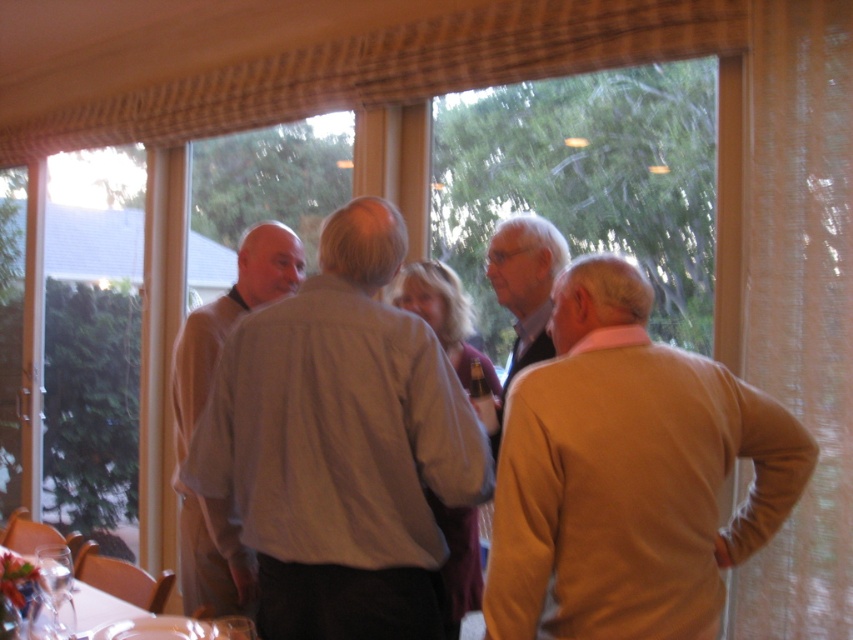
You are planning to take a photo of the two people wearing the light gray shirt at center and the light beige shirt at center. Since you want to capture both in the frame without cropping any part of their shirts, which person should you position closer to the camera?

You should position the light beige shirt at center closer to the camera because its shirt is narrower than the light gray shirt at center, allowing it to fit within the frame more easily when closer.

You are standing in the room and want to move to the point at coordinates (415,490). The room has a large window on the opposite wall. Can you walk directly to the point without passing through any obstacles?

The point at coordinates (415,490) is 5.37 feet away from you, so you can walk directly to it without any obstacles in the way.